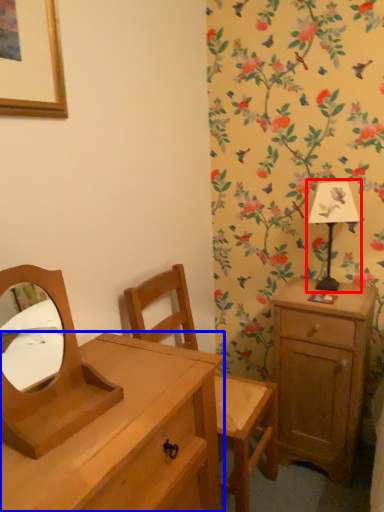
Question: Among these objects, which one is farthest to the camera, bedside lamp (highlighted by a red box) or chest of drawers (highlighted by a blue box)?

Choices:
 (A) bedside lamp
 (B) chest of drawers

Answer: (A)